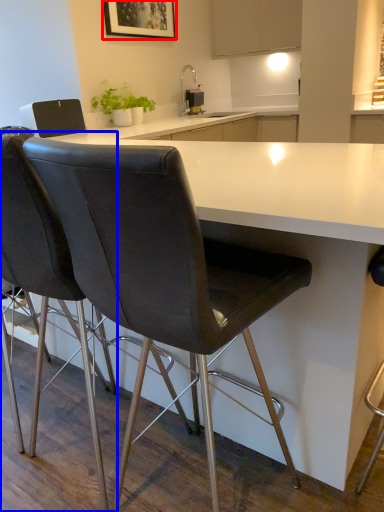
Question: Which object appears farthest to the camera in this image, picture frame (highlighted by a red box) or chair (highlighted by a blue box)?

Choices:
 (A) picture frame
 (B) chair

Answer: (A)